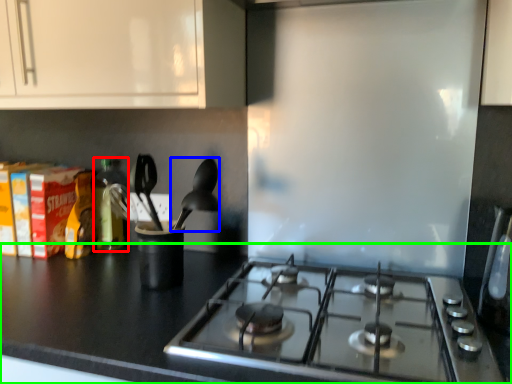
Question: Which is nearer to the bottle (highlighted by a red box)? silverware (highlighted by a blue box) or countertop (highlighted by a green box).

Choices:
 (A) silverware
 (B) countertop

Answer: (A)